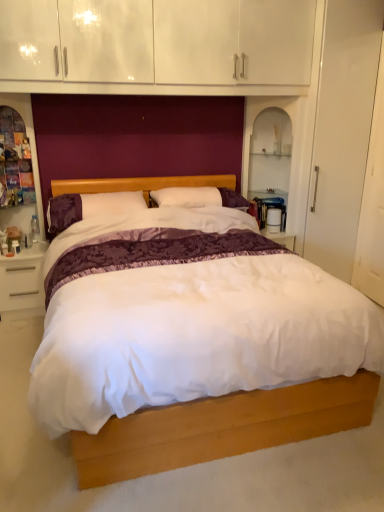
Question: Would you say white glossy nightstand at lower left is inside or outside wooden dresser at left?

Choices:
 (A) inside
 (B) outside

Answer: (B)

Question: Considering the positions of white glossy nightstand at lower left and wooden dresser at left in the image, is white glossy nightstand at lower left bigger or smaller than wooden dresser at left?

Choices:
 (A) big
 (B) small

Answer: (B)

Question: Estimate the real-world distances between objects in this image. Which object is farther from the wooden dresser at left?

Choices:
 (A) white glossy nightstand at lower left
 (B) white satin bed at center
 (C) purple velvet pillow at center

Answer: (B)

Question: Considering the real-world distances, which object is farthest from the wooden dresser at left?

Choices:
 (A) white satin bed at center
 (B) purple velvet pillow at center
 (C) white glossy nightstand at lower left

Answer: (A)